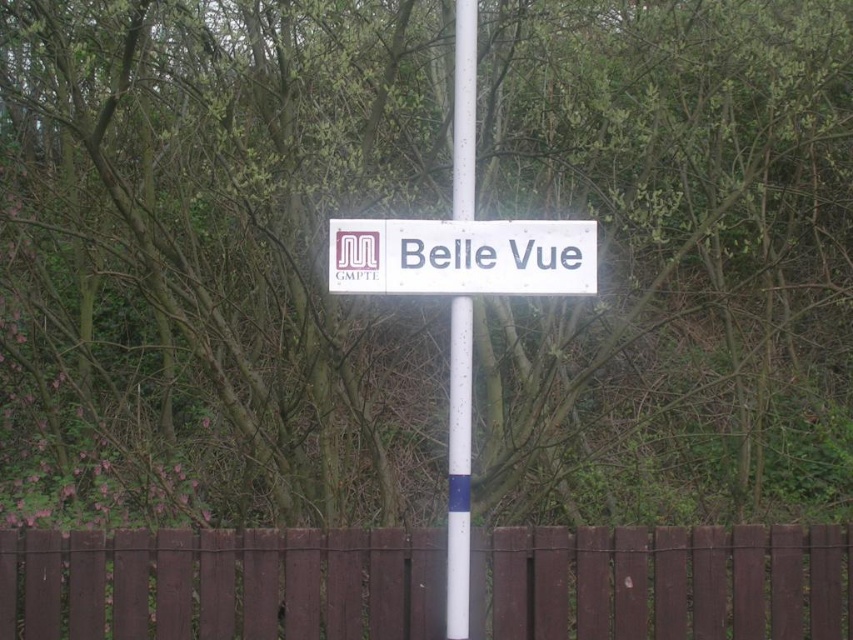
Which of these two, brown wooden fence at center or white plastic pole at center, stands shorter?

brown wooden fence at center is shorter.

Who is more distant from viewer, (851, 552) or (468, 42)?

The point (851, 552) is behind.

Locate an element on the screen. The height and width of the screenshot is (640, 853). brown wooden fence at center is located at coordinates (222, 584).

Between point (572, 273) and point (453, 426), which one is positioned in front?

Positioned in front is point (453, 426).

Is white plastic sign at center above white plastic pole at center?

Indeed, white plastic sign at center is positioned over white plastic pole at center.

The height and width of the screenshot is (640, 853). In order to click on white plastic sign at center in this screenshot , I will do `click(462, 257)`.

From the picture: Is brown wooden fence at center wider than white plastic sign at center?

Yes, brown wooden fence at center is wider than white plastic sign at center.

Is brown wooden fence at center bigger than white plastic sign at center?

Yes, brown wooden fence at center is bigger than white plastic sign at center.

Between point (271, 579) and point (403, 280), which one is positioned behind?

Positioned behind is point (271, 579).

The height and width of the screenshot is (640, 853). In order to click on brown wooden fence at center in this screenshot , I will do `click(222, 584)`.